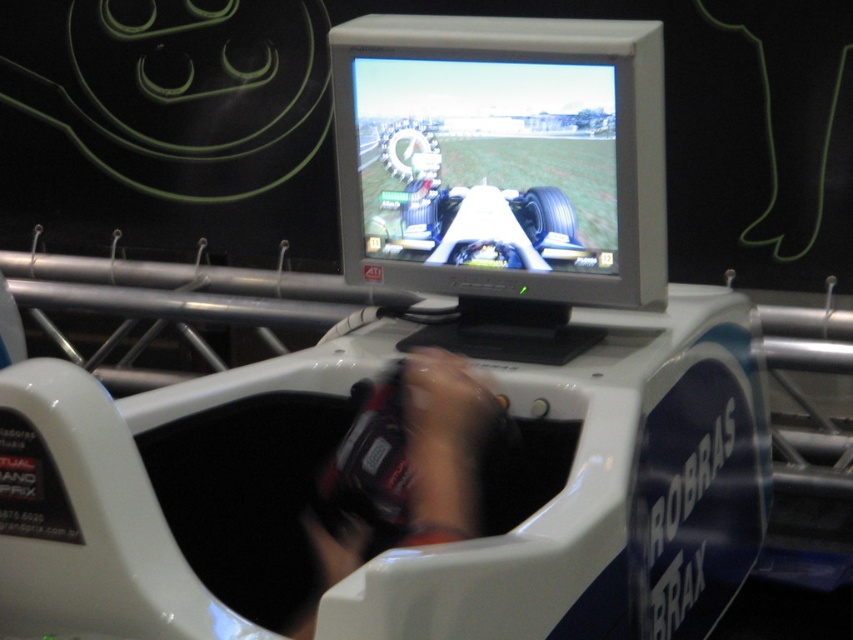
Does point (543, 253) come farther from viewer compared to point (405, 412)?

Yes, point (543, 253) is behind point (405, 412).

Does matte silver monitor at center have a greater width compared to smooth black controller at center?

Correct, the width of matte silver monitor at center exceeds that of smooth black controller at center.

Does point (599, 131) come in front of point (469, 428)?

No.

Identify the location of matte silver monitor at center. (502, 156).